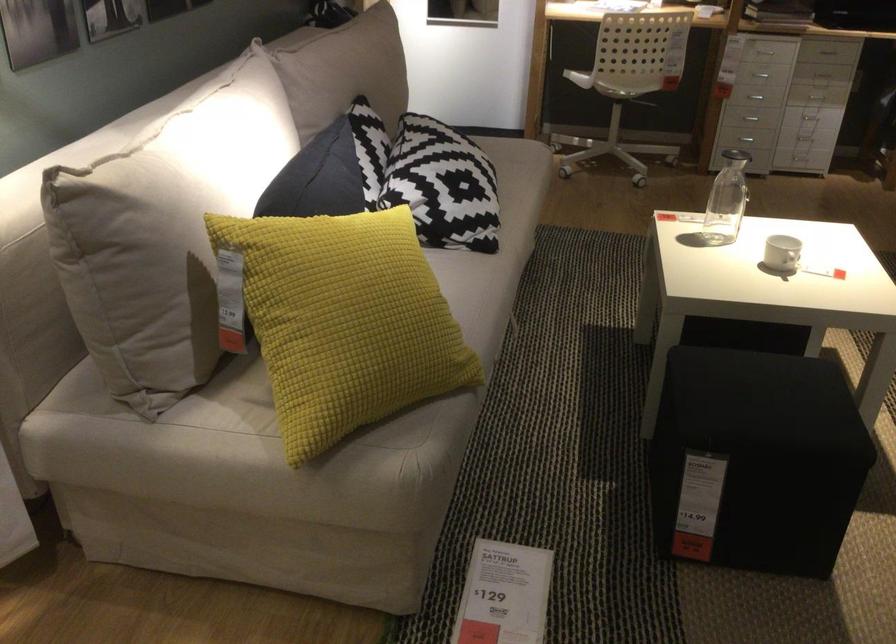
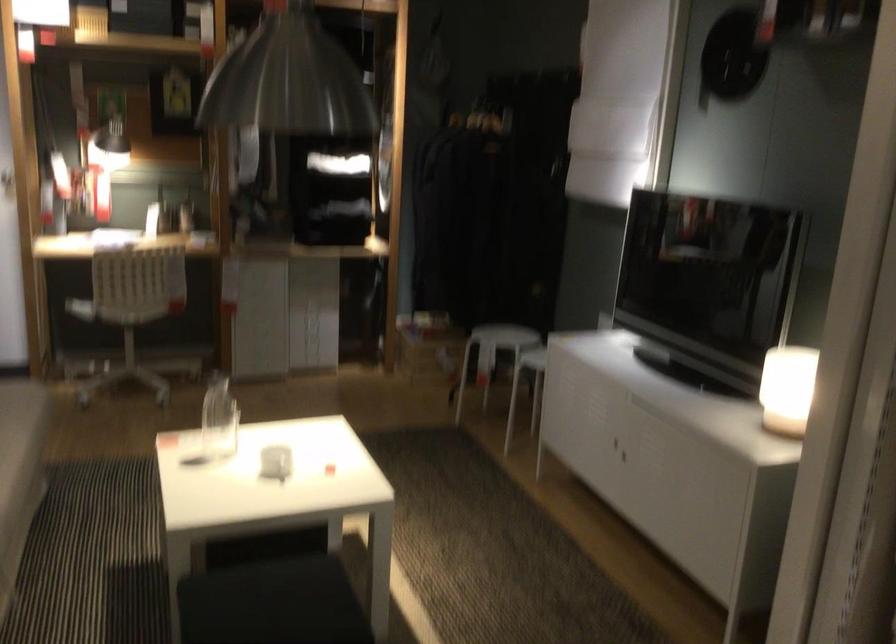
Question: I am providing you with two images of the same scene from different viewpoints. After the viewpoint changes to image2, which objects are now occluded?

Choices:
 (A) white stool
 (B) cabinet door handle
 (C) drawer handle
 (D) white towel

Answer: (C)